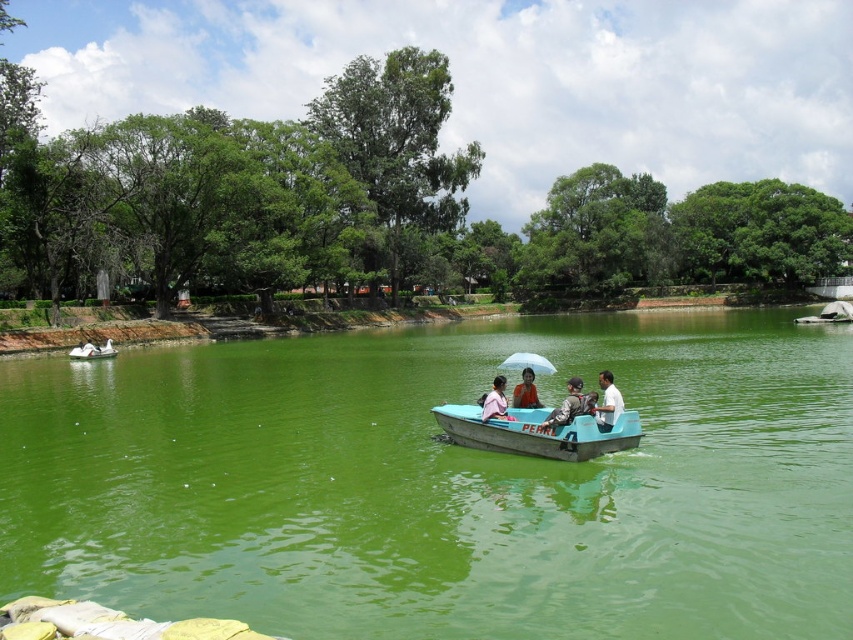
You are a photographer standing at the edge of the water. You want to take a photo of the teal plastic boat at center and the matte gray jacket at center. Which object will appear larger in the photo?

The teal plastic boat at center will appear larger in the photo because it is taller than the matte gray jacket at center.

You are standing on the dock and want to hand a small item to someone wearing the white cotton shirt at center without moving from your spot. The white matte umbrella at center is between you and the shirt. Can you reach them directly, or will the umbrella block your path?

The white cotton shirt at center is 6.74 meters away from the white matte umbrella at center. Since the umbrella is between you and the shirt, it may block your direct line of sight or reach. However, the distance between them is over 6 meters, so unless the umbrella is very large, it might not fully obstruct the path. You might need to adjust your angle or toss the item carefully to avoid the umbrella.

You are a photographer planning to take a photo of the teal plastic boat at center and the matte gray jacket at center. Based on their positions, which object should you focus on first to ensure both are in the frame?

The teal plastic boat at center is located below the matte gray jacket at center. To ensure both are in the frame, focus on the matte gray jacket at center first since it is higher up, allowing the boat to be captured below it.